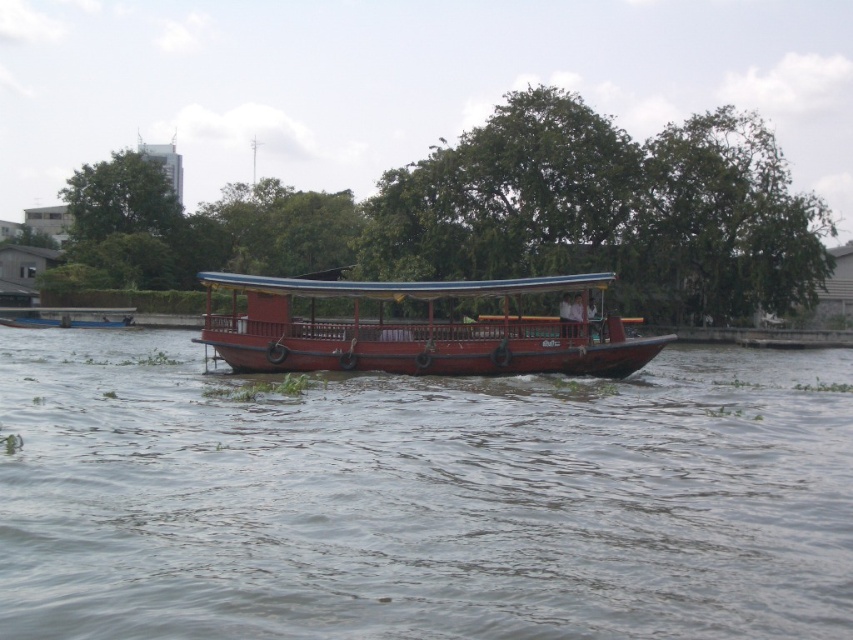
Question: Can you confirm if brown wooden river at center is positioned to the left of green leafy tree at center?

Choices:
 (A) no
 (B) yes

Answer: (B)

Question: Which is nearer to the brown wooden river at center?

Choices:
 (A) wooden boat at center
 (B) green leafy tree at center

Answer: (A)

Question: Is green leafy tree at center positioned at the back of wooden boat at center?

Choices:
 (A) no
 (B) yes

Answer: (B)

Question: Which of the following is the closest to the observer?

Choices:
 (A) wooden boat at center
 (B) brown wooden river at center

Answer: (B)

Question: Which point appears closest to the camera in this image?

Choices:
 (A) (724, 362)
 (B) (688, 292)

Answer: (A)

Question: Is brown wooden river at center positioned behind wooden boat at center?

Choices:
 (A) yes
 (B) no

Answer: (B)